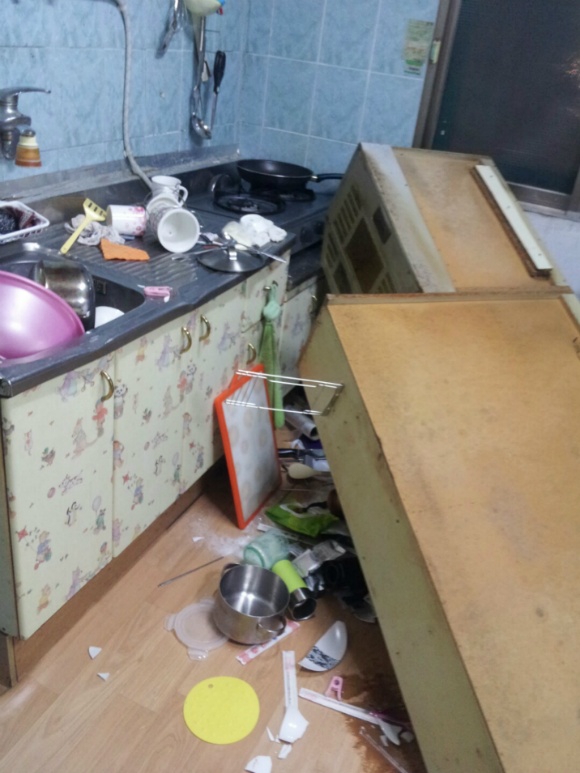
Where is `faucet`? faucet is located at coordinates (17, 93).